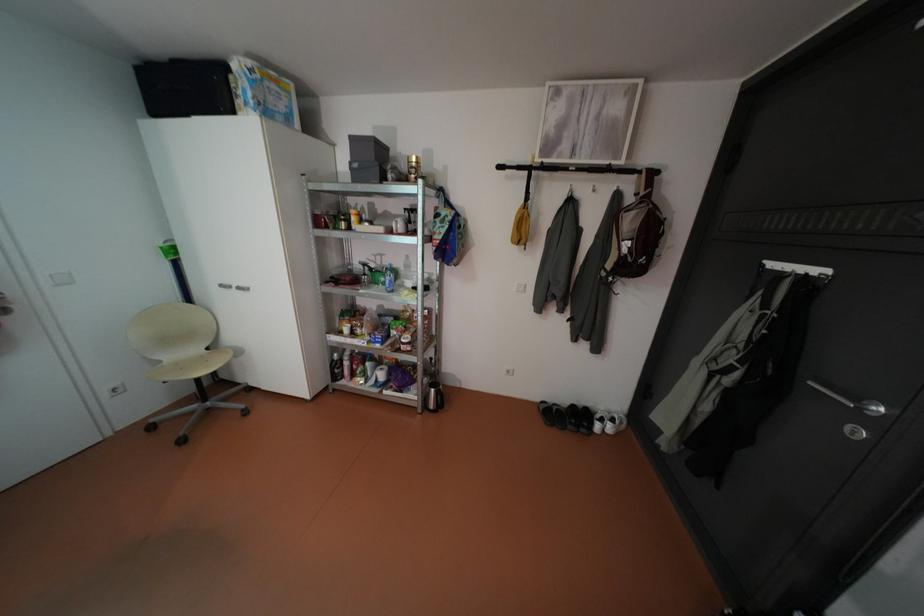
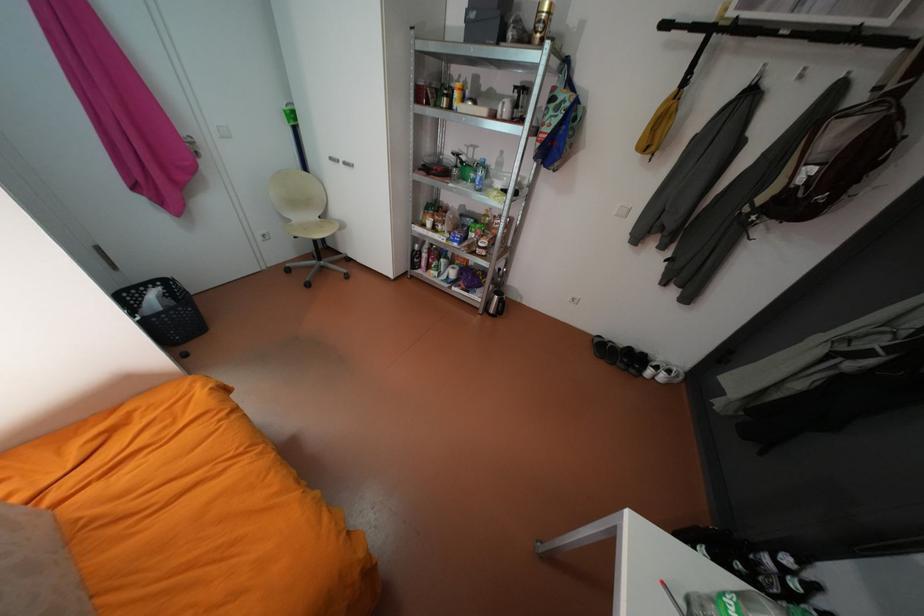
Locate, in the second image, the point that corresponds to (239,286) in the first image.

(347, 160)